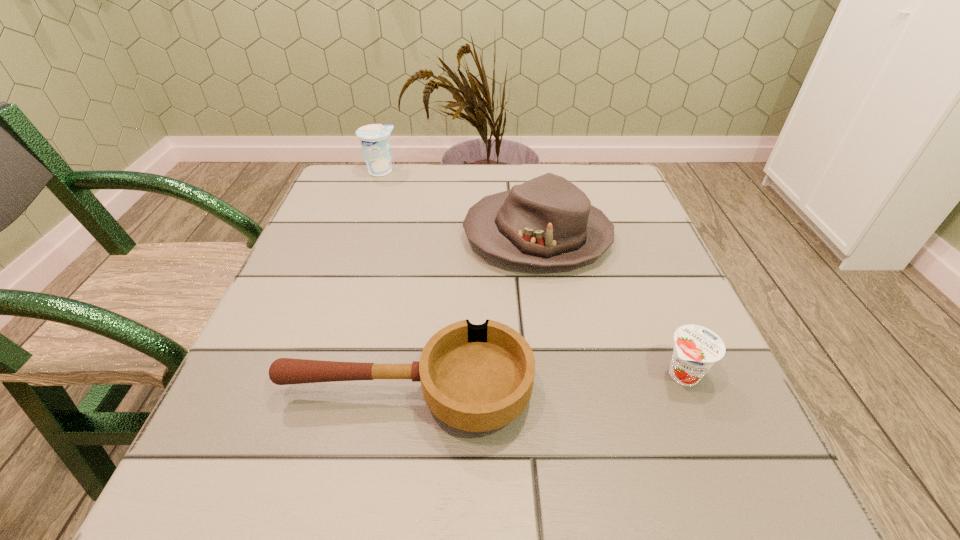
At what (x,y) coordinates should I click in order to perform the action: click on vacant space at the left edge of the desktop. Please return your answer as a coordinate pair (x, y). The image size is (960, 540). Looking at the image, I should click on (324, 270).

Where is `vacant space at the right edge`? This screenshot has width=960, height=540. vacant space at the right edge is located at coordinates (721, 434).

This screenshot has width=960, height=540. I want to click on blank space at the far left corner of the desktop, so click(345, 187).

Locate an element on the screen. free space at the near left corner of the desktop is located at coordinates (220, 508).

Where is `vacant space at the near right corner`? The image size is (960, 540). vacant space at the near right corner is located at coordinates (683, 448).

You are a GUI agent. You are given a task and a screenshot of the screen. Output one action in this format:
    pyautogui.click(x=<x>, y=<y>)
    Task: Click on the unoccupied area between the farthest object and the third nearest object
    
    Given the screenshot: What is the action you would take?
    pyautogui.click(x=459, y=204)

This screenshot has height=540, width=960. Find the location of `empty space that is in between the second farthest object and the shorter yogurt`. empty space that is in between the second farthest object and the shorter yogurt is located at coordinates (611, 305).

Locate an element on the screen. This screenshot has width=960, height=540. free space between the third nearest object and the left yogurt is located at coordinates [x=459, y=204].

Find the location of a particular element. This screenshot has width=960, height=540. free point between the left yogurt and the saucepan is located at coordinates (394, 282).

The width and height of the screenshot is (960, 540). I want to click on vacant region between the nearer yogurt and the left yogurt, so click(532, 273).